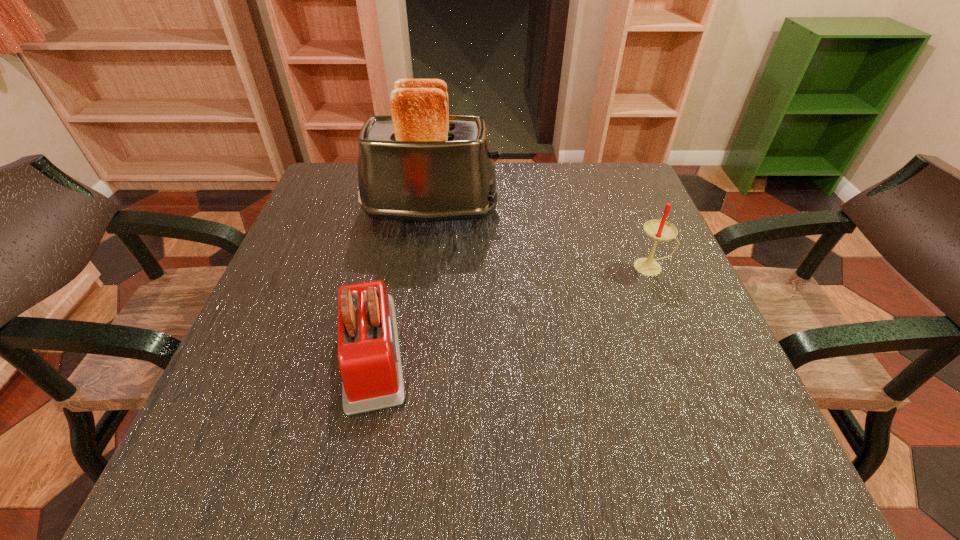
Where is `unoccupied position between the tallest object and the candle`? Image resolution: width=960 pixels, height=540 pixels. unoccupied position between the tallest object and the candle is located at coordinates (541, 239).

Identify the location of vacant area that lies between the farther toaster and the rightmost object. The width and height of the screenshot is (960, 540). (541, 239).

At what (x,y) coordinates should I click in order to perform the action: click on free space between the nearest object and the candle. Please return your answer as a coordinate pair (x, y). This screenshot has width=960, height=540. Looking at the image, I should click on (512, 309).

Where is `blank region between the rightmost object and the shorter toaster`? The image size is (960, 540). blank region between the rightmost object and the shorter toaster is located at coordinates (512, 309).

I want to click on free space between the farthest object and the candle, so click(541, 239).

Locate an element on the screen. This screenshot has width=960, height=540. free space between the rightmost object and the tallest object is located at coordinates (541, 239).

The height and width of the screenshot is (540, 960). In order to click on vacant point located between the tallest object and the nearer toaster in this screenshot , I will do `click(401, 281)`.

Find the location of a particular element. free space that is in between the rightmost object and the nearest object is located at coordinates (512, 309).

I want to click on free point between the shorter toaster and the candle, so click(512, 309).

Locate which object is the closest to the nearer toaster. Please provide its 2D coordinates. Your answer should be formatted as a tuple, i.e. [(x, y)], where the tuple contains the x and y coordinates of a point satisfying the conditions above.

[(421, 164)]